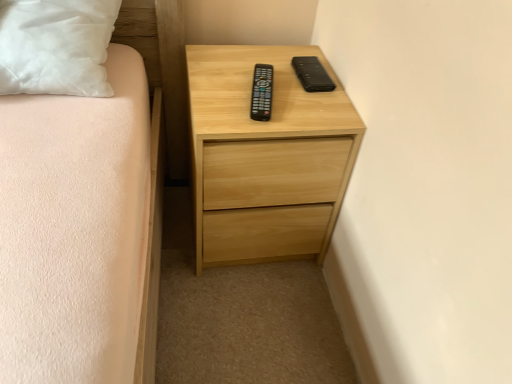
What do you see at coordinates (312, 74) in the screenshot? I see `black matte case at upper right` at bounding box center [312, 74].

The height and width of the screenshot is (384, 512). In order to click on black matte case at upper right in this screenshot , I will do `click(312, 74)`.

Can you confirm if black matte case at upper right is positioned to the left of natural wood chest of drawers at center?

No, black matte case at upper right is not to the left of natural wood chest of drawers at center.

Does black matte case at upper right have a greater height compared to natural wood chest of drawers at center?

No.

From the image's perspective, is black matte case at upper right beneath natural wood chest of drawers at center?

No.

Measure the distance between black matte case at upper right and natural wood chest of drawers at center.

A distance of 9.99 inches exists between black matte case at upper right and natural wood chest of drawers at center.

Does point (298, 61) come behind point (267, 87)?

Yes.

Which object is positioned more to the right, black matte case at upper right or black plastic remote at center?

black matte case at upper right is more to the right.

Would you say black matte case at upper right is inside or outside black plastic remote at center?

black matte case at upper right cannot be found inside black plastic remote at center.

What's the angular difference between black plastic remote at center and black matte case at upper right's facing directions?

They differ by 12.8 degrees in their facing directions.

Between black plastic remote at center and black matte case at upper right, which one appears on the right side from the viewer's perspective?

From the viewer's perspective, black matte case at upper right appears more on the right side.

Considering the relative sizes of black plastic remote at center and black matte case at upper right in the image provided, is black plastic remote at center wider than black matte case at upper right?

Yes, black plastic remote at center is wider than black matte case at upper right.

Considering the points (256, 99) and (310, 74), which point is in front, point (256, 99) or point (310, 74)?

Positioned in front is point (256, 99).

In the scene shown: From the image's perspective, relative to natural wood chest of drawers at center, is black plastic remote at center above or below?

From the image's perspective, black plastic remote at center appears above natural wood chest of drawers at center.

Which is in front, point (261, 108) or point (244, 126)?

Positioned in front is point (244, 126).

Can you confirm if black plastic remote at center is smaller than natural wood chest of drawers at center?

Correct, black plastic remote at center occupies less space than natural wood chest of drawers at center.

Is natural wood chest of drawers at center at the back of black plastic remote at center?

That's not correct — black plastic remote at center is not looking away from natural wood chest of drawers at center.

Where is `chest of drawers on the left of black plastic remote at center`? The height and width of the screenshot is (384, 512). chest of drawers on the left of black plastic remote at center is located at coordinates (266, 157).

Does natural wood chest of drawers at center appear on the right side of black plastic remote at center?

No.

Is natural wood chest of drawers at center wider or thinner than black plastic remote at center?

Clearly, natural wood chest of drawers at center has more width compared to black plastic remote at center.

From a real-world perspective, is natural wood chest of drawers at center physically located above or below black matte case at upper right?

Clearly, from a real-world perspective, natural wood chest of drawers at center is below black matte case at upper right.

Consider the image. Considering the sizes of objects natural wood chest of drawers at center and black matte case at upper right in the image provided, who is wider, natural wood chest of drawers at center or black matte case at upper right?

natural wood chest of drawers at center is wider.

How many degrees apart are the facing directions of natural wood chest of drawers at center and black matte case at upper right?

The angle between the facing direction of natural wood chest of drawers at center and the facing direction of black matte case at upper right is 3.19 degrees.

Which object is positioned more to the right, natural wood chest of drawers at center or black matte case at upper right?

black matte case at upper right.

Where is `gadget lying behind the natural wood chest of drawers at center`? This screenshot has width=512, height=384. gadget lying behind the natural wood chest of drawers at center is located at coordinates [x=312, y=74].

Locate an element on the screen. The width and height of the screenshot is (512, 384). control that appears above the black matte case at upper right (from a real-world perspective) is located at coordinates point(262,92).

Considering their positions, is natural wood chest of drawers at center positioned closer to black plastic remote at center than black matte case at upper right?

black matte case at upper right.

From the image, which object appears to be farther from natural wood chest of drawers at center, black matte case at upper right or black plastic remote at center?

black matte case at upper right.

Considering their positions, is natural wood chest of drawers at center positioned closer to black matte case at upper right than black plastic remote at center?

The object closer to black matte case at upper right is black plastic remote at center.

From the image, which object appears to be nearer to black plastic remote at center, black matte case at upper right or natural wood chest of drawers at center?

The object closer to black plastic remote at center is black matte case at upper right.

Looking at the image, which one is located closer to black matte case at upper right, black plastic remote at center or natural wood chest of drawers at center?

black plastic remote at center is positioned closer to the anchor black matte case at upper right.

Considering their positions, is black plastic remote at center positioned closer to natural wood chest of drawers at center than black matte case at upper right?

Based on the image, black plastic remote at center appears to be nearer to natural wood chest of drawers at center.

Identify the location of control that lies between black matte case at upper right and natural wood chest of drawers at center from top to bottom. The width and height of the screenshot is (512, 384). (262, 92).